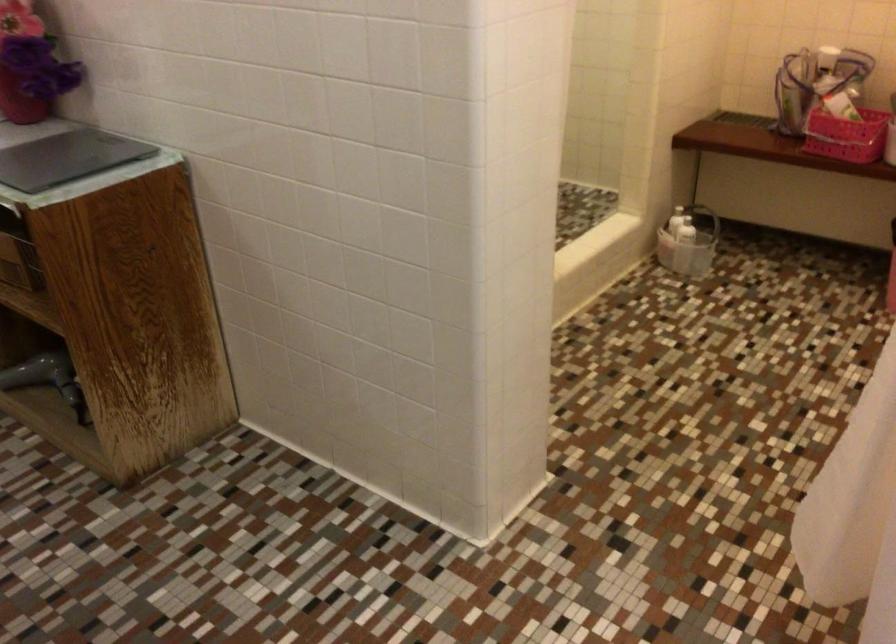
The width and height of the screenshot is (896, 644). Describe the element at coordinates (703, 216) in the screenshot. I see `the white caddy handle` at that location.